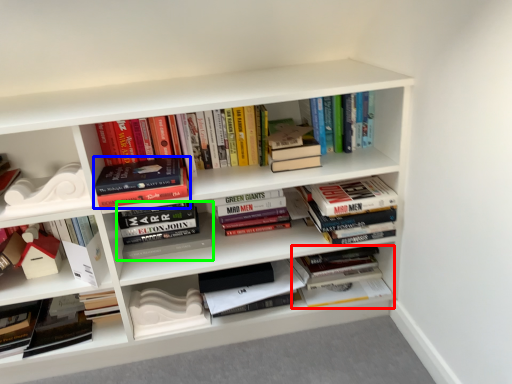
Question: Which object is the closest to the book (highlighted by a red box)? Choose among these: book (highlighted by a blue box) or book (highlighted by a green box).

Choices:
 (A) book
 (B) book

Answer: (B)